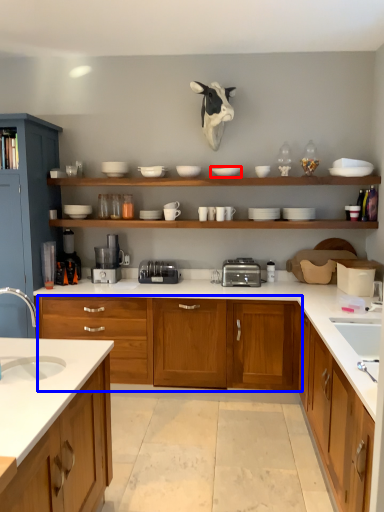
Question: Which object appears farthest to the camera in this image, tableware (highlighted by a red box) or cabinetry (highlighted by a blue box)?

Choices:
 (A) tableware
 (B) cabinetry

Answer: (A)